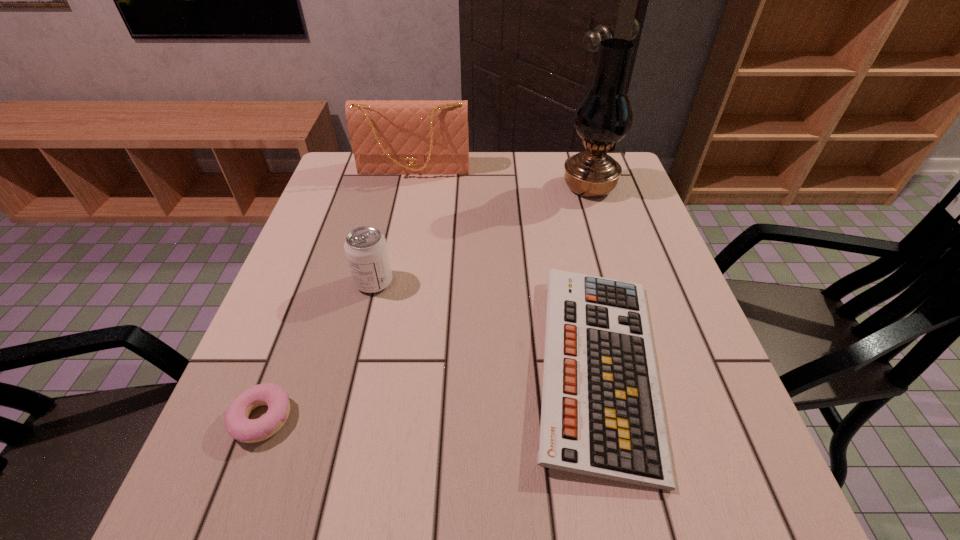
Identify the location of the tallest object. The image size is (960, 540). (604, 116).

I want to click on the second tallest object, so click(x=422, y=137).

The image size is (960, 540). What are the coordinates of `the third tallest object` in the screenshot? It's located at (366, 249).

The height and width of the screenshot is (540, 960). Identify the location of doughnut. (238, 426).

Locate an element on the screen. The image size is (960, 540). computer keyboard is located at coordinates (601, 414).

I want to click on vacant space situated 0.250m on the front of the tallest object, so click(x=613, y=267).

This screenshot has height=540, width=960. Find the location of `vacant space positioned on the front-facing side of the handbag`. vacant space positioned on the front-facing side of the handbag is located at coordinates (394, 273).

At what (x,y) coordinates should I click in order to perform the action: click on vacant area situated 0.300m on the right of the soda can. Please return your answer as a coordinate pair (x, y). Looking at the image, I should click on (528, 282).

Locate an element on the screen. The width and height of the screenshot is (960, 540). vacant space located 0.090m on the back of the doughnut is located at coordinates (288, 350).

Find the location of `vacant region located 0.190m on the back of the computer keyboard`. vacant region located 0.190m on the back of the computer keyboard is located at coordinates (567, 227).